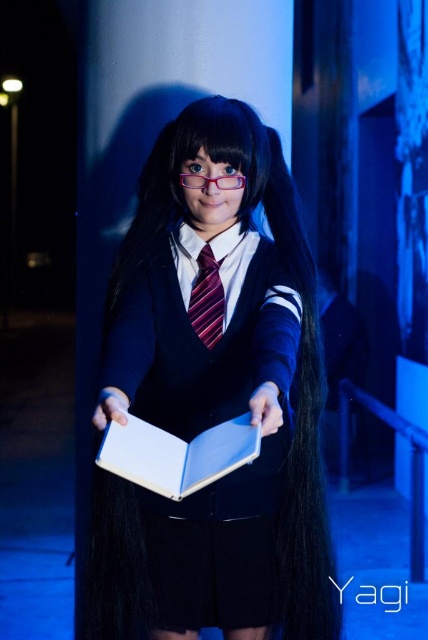
Which of these two, white matte book at center or striped silk tie at center, stands taller?

Standing taller between the two is striped silk tie at center.

Does point (127, 449) come farther from viewer compared to point (192, 298)?

That is False.

The image size is (428, 640). In order to click on white matte book at center in this screenshot , I will do [x=177, y=454].

Is matte black uniform at center positioned before striped silk tie at center?

Yes.

At what (x,y) coordinates should I click in order to perform the action: click on matte black uniform at center. Please return your answer as a coordinate pair (x, y). This screenshot has height=640, width=428. Looking at the image, I should click on (216, 397).

Where is `matte black uniform at center`? matte black uniform at center is located at coordinates (216, 397).

Does point (131, 506) come behind point (249, 442)?

Yes, point (131, 506) is behind point (249, 442).

Locate an element on the screen. This screenshot has height=640, width=428. matte black uniform at center is located at coordinates (216, 397).